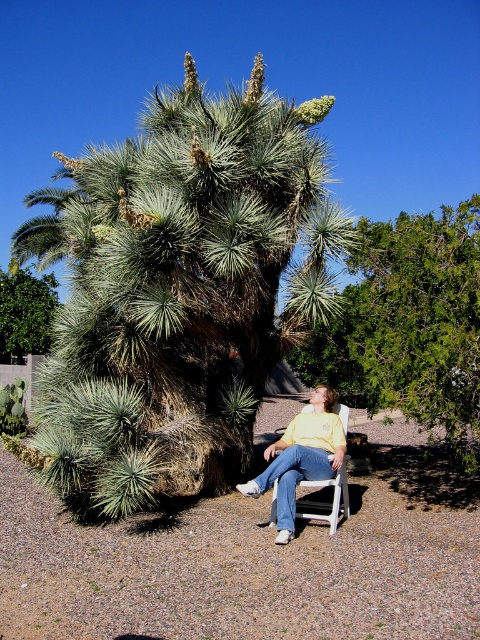
Is green needle-like at right taller than white plastic chair at center?

Yes, green needle-like at right is taller than white plastic chair at center.

Locate an element on the screen. Image resolution: width=480 pixels, height=640 pixels. green needle-like at right is located at coordinates (420, 320).

Between green spiky palm tree at center and green needle-like at right, which one is positioned higher?

green spiky palm tree at center is higher up.

Which is more to the left, green spiky palm tree at center or green needle-like at right?

green spiky palm tree at center is more to the left.

At what (x,y) coordinates should I click in order to perform the action: click on green spiky palm tree at center. Please return your answer as a coordinate pair (x, y). The width and height of the screenshot is (480, 640). Looking at the image, I should click on (178, 285).

Can you confirm if green spiky palm tree at center is positioned to the right of green leafy bush at upper left?

Yes, green spiky palm tree at center is to the right of green leafy bush at upper left.

Which of these two, green spiky palm tree at center or green leafy bush at upper left, stands shorter?

green leafy bush at upper left is shorter.

Does point (146, 246) come behind point (32, 291)?

No, it is in front of (32, 291).

In order to click on green spiky palm tree at center in this screenshot , I will do `click(178, 285)`.